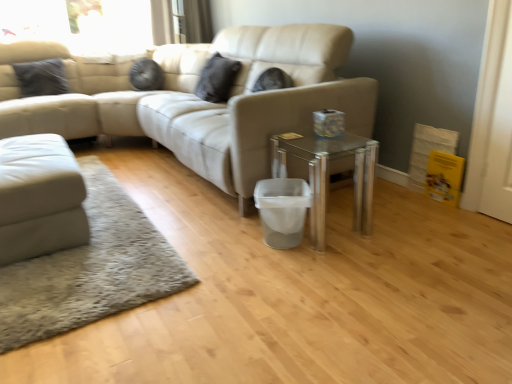
Locate an element on the screen. spots to the right of transparent glass table at center is located at coordinates (397, 227).